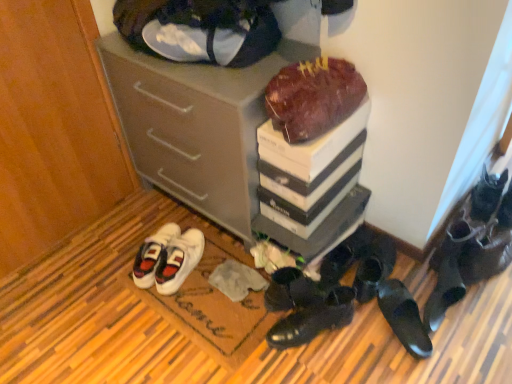
Locate an element on the screen. The height and width of the screenshot is (384, 512). vacant space that is in between black leather shoes at lower right, the fourth footwear from the right, and black leather shoes at lower center, placed as the 8th footwear when sorted from right to left is located at coordinates (345, 350).